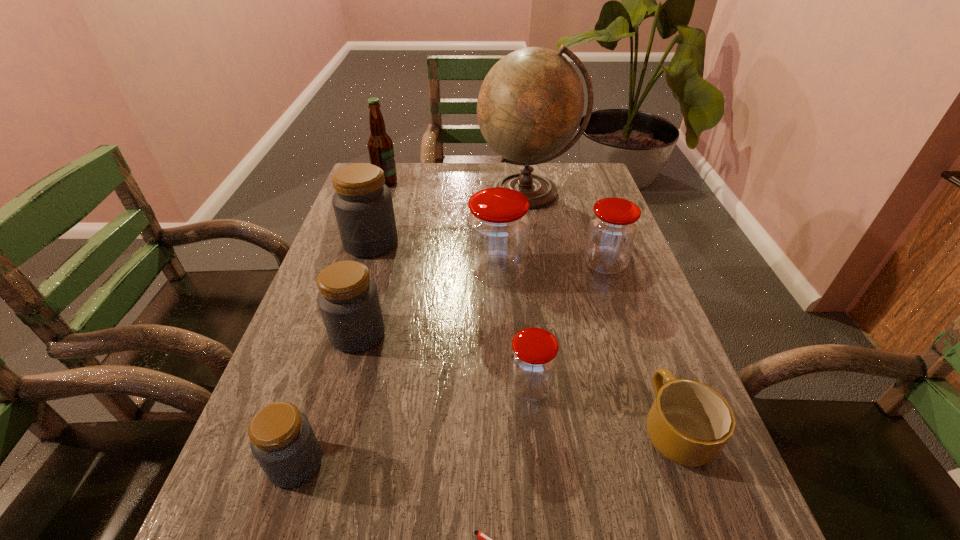
I want to click on free space between the second shortest object and the nearest jar, so click(x=485, y=446).

Find the location of `vacant region between the biggest red jar and the ninth shortest object`. vacant region between the biggest red jar and the ninth shortest object is located at coordinates (442, 228).

What are the coordinates of `object that is the closest one to the shortest object` in the screenshot? It's located at (689, 423).

Where is `object that is the ninth closest to the rightmost red jar`? Image resolution: width=960 pixels, height=540 pixels. object that is the ninth closest to the rightmost red jar is located at coordinates (282, 440).

The image size is (960, 540). I want to click on the sixth closest jar to the beer bottle, so click(x=282, y=440).

This screenshot has width=960, height=540. Identify the location of jar identified as the closest to the biggest red jar. (613, 226).

This screenshot has height=540, width=960. Identify the location of gray jar that stands as the third closest to the biggest red jar. (282, 440).

You are a GUI agent. You are given a task and a screenshot of the screen. Output one action in this format:
    pyautogui.click(x=<x>, y=<y>)
    Task: Click on the gray jar that stands as the closest to the smallest red jar
    This screenshot has height=540, width=960.
    Given the screenshot: What is the action you would take?
    pyautogui.click(x=348, y=299)

Identify which red jar is the closest to the biggest red jar. Please provide its 2D coordinates. Your answer should be formatted as a tuple, i.e. [(x, y)], where the tuple contains the x and y coordinates of a point satisfying the conditions above.

[(613, 226)]

Image resolution: width=960 pixels, height=540 pixels. Find the location of `the closest red jar to the nearest red jar`. the closest red jar to the nearest red jar is located at coordinates (498, 224).